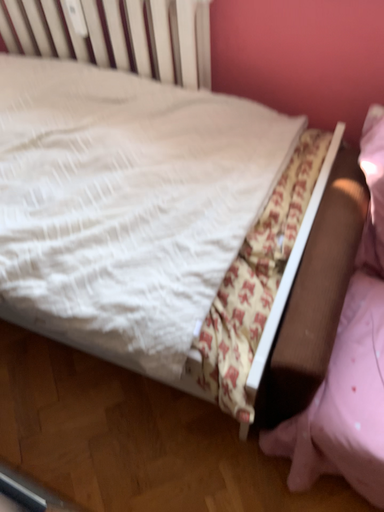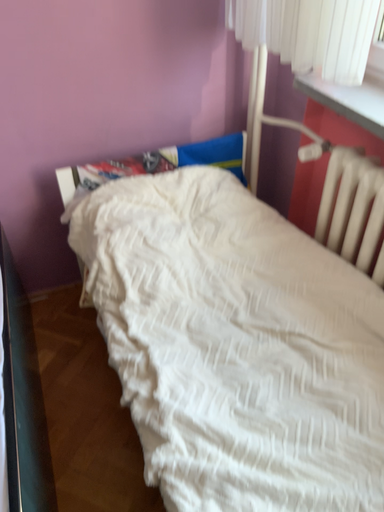
Question: How did the camera likely rotate when shooting the video?

Choices:
 (A) rotated right
 (B) rotated left

Answer: (B)